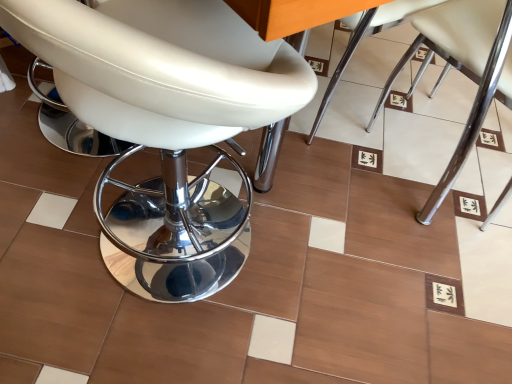
Where is `vacant space to the right of white leather stool at left, which appears as the first chair when viewed from the left`? This screenshot has height=384, width=512. vacant space to the right of white leather stool at left, which appears as the first chair when viewed from the left is located at coordinates (343, 305).